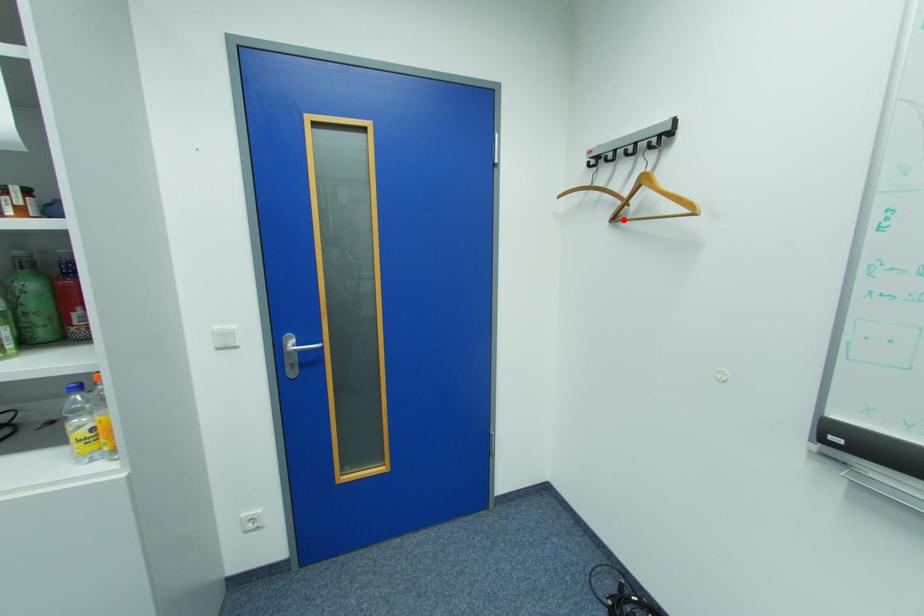
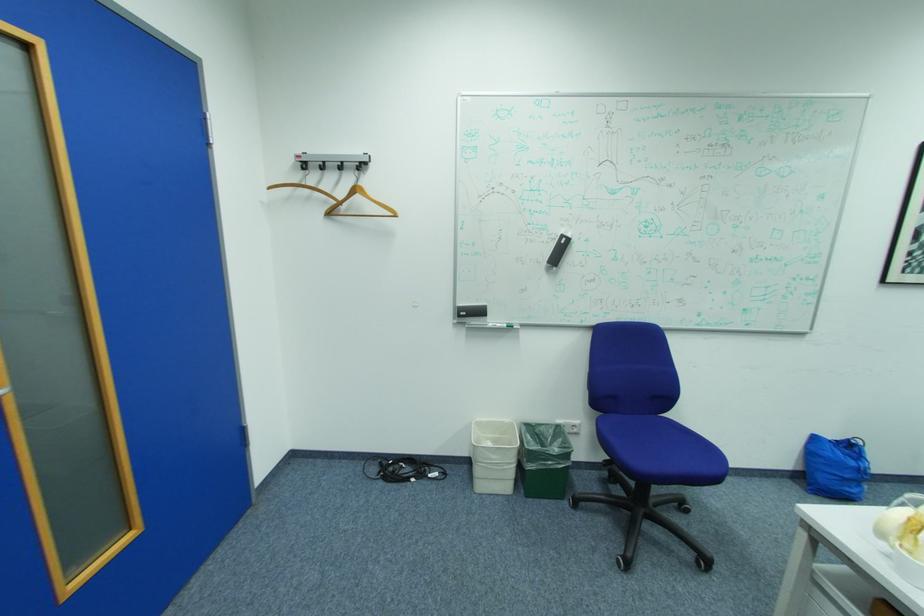
Locate, in the second image, the point that corresponds to the highlighted location in the first image.

(337, 214)